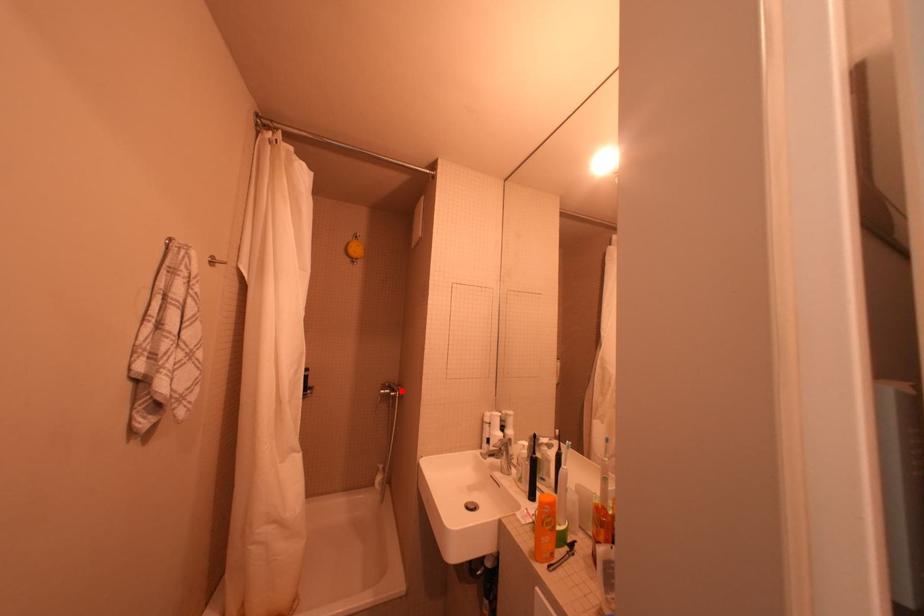
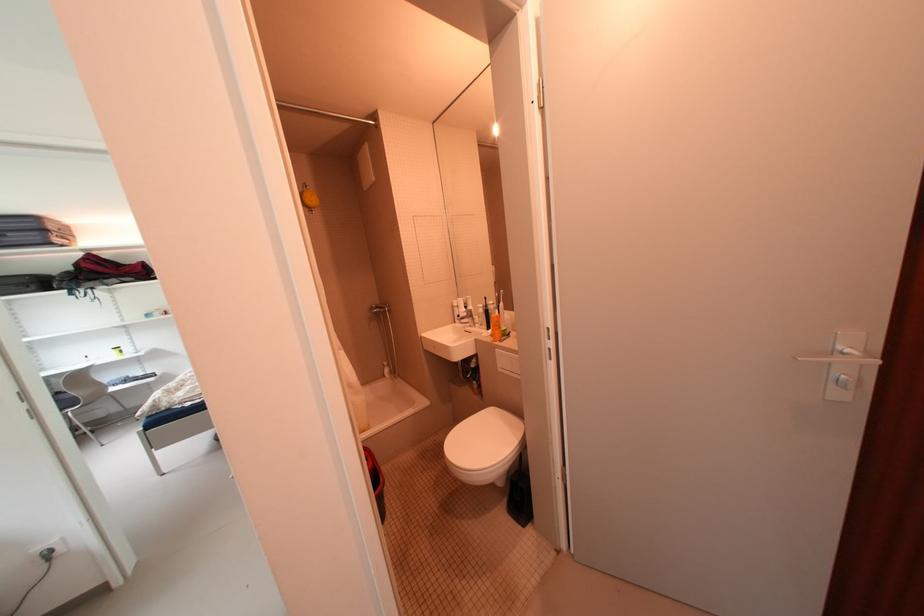
Question: I am providing you with two images of the same scene from different viewpoints. Given a red point in image1, look at the same physical point in image2. Is it:

Choices:
 (A) Closer to the viewpoint
 (B) Farther from the viewpoint

Answer: (A)